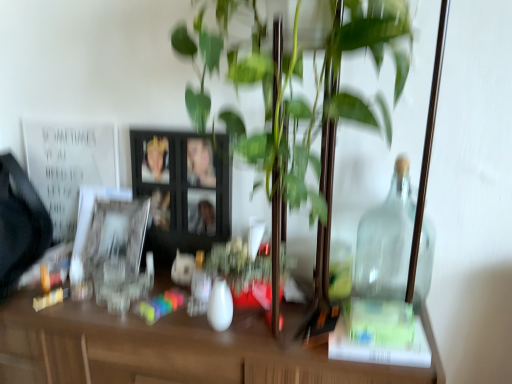
Where is `white paper at upper left`? This screenshot has height=384, width=512. white paper at upper left is located at coordinates (69, 166).

How much space does black wooden picture frame at center, the 2th picture frame in the left-to-right sequence, occupy horizontally?

It is 7.65 centimeters.

What do you see at coordinates (116, 247) in the screenshot? I see `white glossy picture frame at left, the second picture frame positioned from the right` at bounding box center [116, 247].

Find the location of `white paper at upper left`. white paper at upper left is located at coordinates (69, 166).

Is white paper at upper left not within transparent glass jar at right?

Yes, white paper at upper left is located beyond the bounds of transparent glass jar at right.

Does white paper at upper left have a lesser height compared to transparent glass jar at right?

No.

Does white paper at upper left appear on the right side of transparent glass jar at right?

No.

There is a transparent glass jar at right. Where is `bulletin board above it (from a real-world perspective)`? The height and width of the screenshot is (384, 512). bulletin board above it (from a real-world perspective) is located at coordinates (69, 166).

Considering the positions of objects white glossy vase at center and transparent glass jar at right in the image provided, who is in front, white glossy vase at center or transparent glass jar at right?

transparent glass jar at right.

Does white glossy vase at center have a greater width compared to transparent glass jar at right?

No.

Is white glossy vase at center positioned beyond the bounds of transparent glass jar at right?

white glossy vase at center is positioned outside transparent glass jar at right.

Consider the image. Who is shorter, white glossy vase at center or transparent glass jar at right?

Standing shorter between the two is white glossy vase at center.

Looking at this image, would you say white glossy vase at center is to the left or to the right of green glossy plant at center in the picture?

white glossy vase at center is to the left of green glossy plant at center.

Can you confirm if white glossy vase at center is taller than green glossy plant at center?

No.

Are white glossy vase at center and green glossy plant at center beside each other?

No, white glossy vase at center is not in contact with green glossy plant at center.

Locate an element on the screen. The height and width of the screenshot is (384, 512). houseplant on the right of the white glossy vase at center is located at coordinates (309, 122).

From a real-world perspective, is white paper at upper left located beneath black wooden picture frame at center, the 1th picture frame in the right-to-left sequence?

Actually, white paper at upper left is physically above black wooden picture frame at center, the 1th picture frame in the right-to-left sequence, in the real world.

Is white paper at upper left beside black wooden picture frame at center, the 2th picture frame in the left-to-right sequence?

No, white paper at upper left is not touching black wooden picture frame at center, the 2th picture frame in the left-to-right sequence.

I want to click on picture frame that is the 2nd one when counting rightward from the white paper at upper left, so click(182, 189).

How many degrees apart are the facing directions of white paper at upper left and black wooden picture frame at center, the 2th picture frame in the left-to-right sequence?

The facing directions of white paper at upper left and black wooden picture frame at center, the 2th picture frame in the left-to-right sequence, are 2.9 degrees apart.

Who is bigger, white paper at upper left or white glossy vase at center?

white paper at upper left is bigger.

Can you confirm if white paper at upper left is wider than white glossy vase at center?

Yes, white paper at upper left is wider than white glossy vase at center.

Can you tell me how much white paper at upper left and white glossy vase at center differ in facing direction?

3.77 degrees.

Between white paper at upper left and white glossy vase at center, which one has less height?

Standing shorter between the two is white glossy vase at center.

Between black wooden picture frame at center, the 2th picture frame in the left-to-right sequence, and green glossy plant at center, which one appears on the right side from the viewer's perspective?

From the viewer's perspective, green glossy plant at center appears more on the right side.

In the scene shown: Looking at the image, does black wooden picture frame at center, the 1th picture frame in the right-to-left sequence, seem bigger or smaller compared to green glossy plant at center?

black wooden picture frame at center, the 1th picture frame in the right-to-left sequence, is smaller than green glossy plant at center.

Locate an element on the screen. The height and width of the screenshot is (384, 512). picture frame that is the 1st object located below the green glossy plant at center (from the image's perspective) is located at coordinates (182, 189).

From a real-world perspective, between white glossy vase at center and black wooden picture frame at center, the 1th picture frame in the right-to-left sequence, who is vertically lower?

In real-world perspective, white glossy vase at center is lower.

You are a GUI agent. You are given a task and a screenshot of the screen. Output one action in this format:
    pyautogui.click(x=<x>, y=<y>)
    Task: Click on the vase that is in front of the black wooden picture frame at center, the 2th picture frame in the left-to-right sequence
    The image size is (512, 384).
    Given the screenshot: What is the action you would take?
    pyautogui.click(x=220, y=305)

From the image's perspective, would you say white glossy vase at center is positioned over black wooden picture frame at center, the 1th picture frame in the right-to-left sequence?

Actually, white glossy vase at center appears below black wooden picture frame at center, the 1th picture frame in the right-to-left sequence, in the image.

Is white glossy vase at center positioned behind black wooden picture frame at center, the 1th picture frame in the right-to-left sequence?

No, white glossy vase at center is in front of black wooden picture frame at center, the 1th picture frame in the right-to-left sequence.

Find the location of `glass jar that appears below the white paper at upper left (from the image's perspective)`. glass jar that appears below the white paper at upper left (from the image's perspective) is located at coordinates (389, 266).

The width and height of the screenshot is (512, 384). Identify the location of vase below the transparent glass jar at right (from a real-world perspective). (220, 305).

Estimate the real-world distances between objects in this image. Which object is closer to white paper at upper left, green glossy plant at center or white glossy picture frame at left, acting as the first picture frame starting from the left?

Among the two, white glossy picture frame at left, acting as the first picture frame starting from the left, is located nearer to white paper at upper left.

Looking at the image, which one is located closer to transparent glass jar at right, white glossy vase at center or black wooden picture frame at center, the 1th picture frame in the right-to-left sequence?

white glossy vase at center lies closer to transparent glass jar at right than the other object.

From the image, which object appears to be farther from black wooden picture frame at center, the 1th picture frame in the right-to-left sequence, green glossy plant at center or white paper at upper left?

green glossy plant at center is positioned further to the anchor black wooden picture frame at center, the 1th picture frame in the right-to-left sequence.

Which object lies nearer to the anchor point white paper at upper left, green glossy plant at center or black wooden picture frame at center, the 1th picture frame in the right-to-left sequence?

The object closer to white paper at upper left is black wooden picture frame at center, the 1th picture frame in the right-to-left sequence.

From the image, which object appears to be nearer to white glossy vase at center, transparent glass jar at right or white glossy picture frame at left, acting as the first picture frame starting from the left?

white glossy picture frame at left, acting as the first picture frame starting from the left.

Looking at the image, which one is located closer to green glossy plant at center, transparent glass jar at right or white glossy vase at center?

Among the two, transparent glass jar at right is located nearer to green glossy plant at center.

Which object lies further to the anchor point white glossy vase at center, black wooden picture frame at center, the 1th picture frame in the right-to-left sequence, or transparent glass jar at right?

transparent glass jar at right is further to white glossy vase at center.

From the image, which object appears to be nearer to green glossy plant at center, white glossy picture frame at left, the second picture frame positioned from the right, or white glossy vase at center?

Among the two, white glossy vase at center is located nearer to green glossy plant at center.

Locate an element on the screen. This screenshot has width=512, height=384. glass jar between green glossy plant at center and black wooden picture frame at center, the 1th picture frame in the right-to-left sequence, from front to back is located at coordinates (389, 266).

Locate an element on the screen. The width and height of the screenshot is (512, 384). vase between green glossy plant at center and white glossy picture frame at left, acting as the first picture frame starting from the left, along the z-axis is located at coordinates (220, 305).

Where is `picture frame between white paper at upper left and black wooden picture frame at center, the 2th picture frame in the left-to-right sequence`? This screenshot has height=384, width=512. picture frame between white paper at upper left and black wooden picture frame at center, the 2th picture frame in the left-to-right sequence is located at coordinates (116, 247).

Where is `vase located between black wooden picture frame at center, the 2th picture frame in the left-to-right sequence, and transparent glass jar at right in the left-right direction`? Image resolution: width=512 pixels, height=384 pixels. vase located between black wooden picture frame at center, the 2th picture frame in the left-to-right sequence, and transparent glass jar at right in the left-right direction is located at coordinates (220, 305).